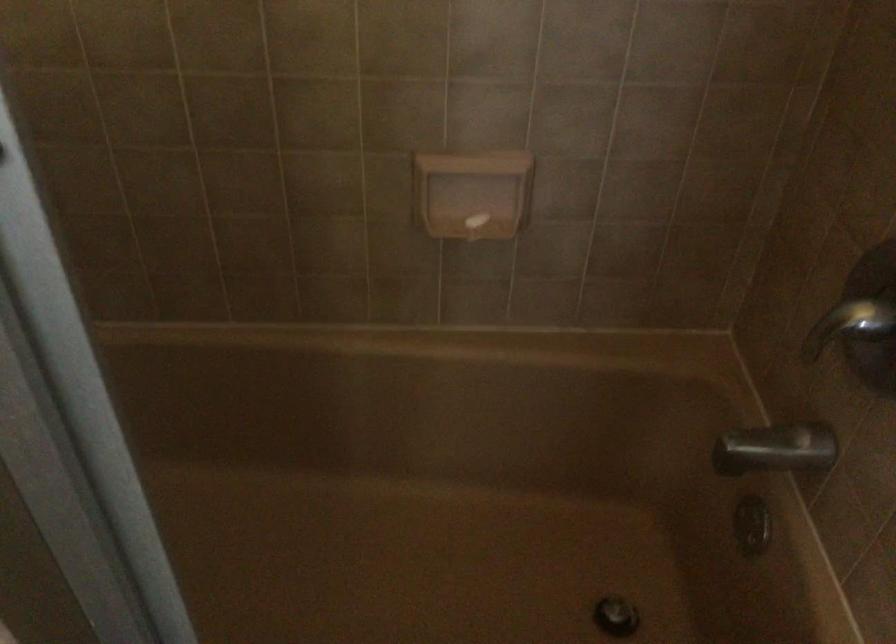
Where is `faucet diverter knob`? faucet diverter knob is located at coordinates (849, 325).